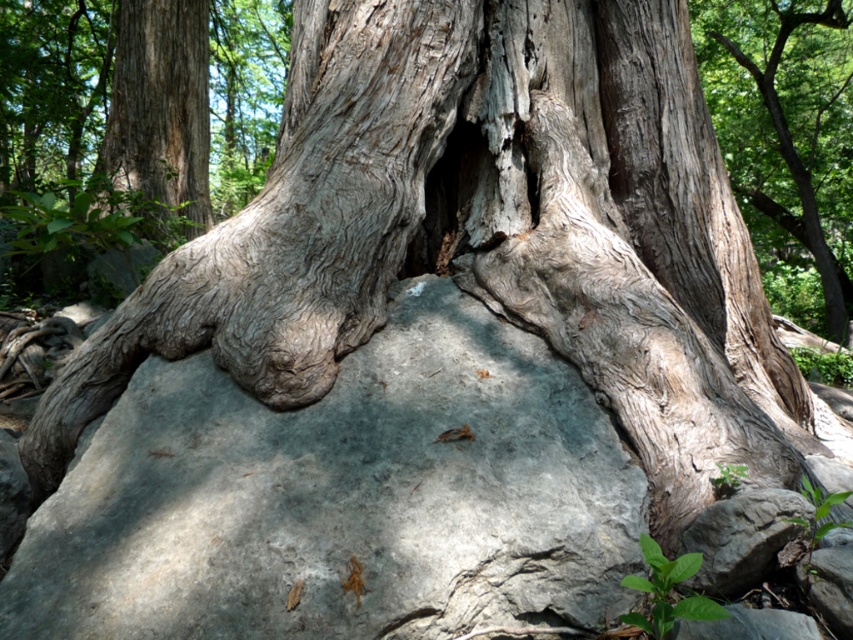
Question: Which point is closer to the camera?

Choices:
 (A) gray rough rock at lower right
 (B) smooth gray bark at center

Answer: (A)

Question: Which point appears farthest from the camera in this image?

Choices:
 (A) (183, 26)
 (B) (757, 548)

Answer: (A)

Question: Considering the relative positions of gray/rough rock at center and smooth gray bark at center in the image provided, where is gray/rough rock at center located with respect to smooth gray bark at center?

Choices:
 (A) right
 (B) left

Answer: (B)

Question: Is smooth gray bark at center closer to the viewer compared to gray rough rock at lower right?

Choices:
 (A) yes
 (B) no

Answer: (B)

Question: Does gray/rough rock at center appear on the right side of gray rough rock at lower right?

Choices:
 (A) no
 (B) yes

Answer: (A)

Question: Among these points, which one is nearest to the camera?

Choices:
 (A) (590, 552)
 (B) (722, 113)

Answer: (A)